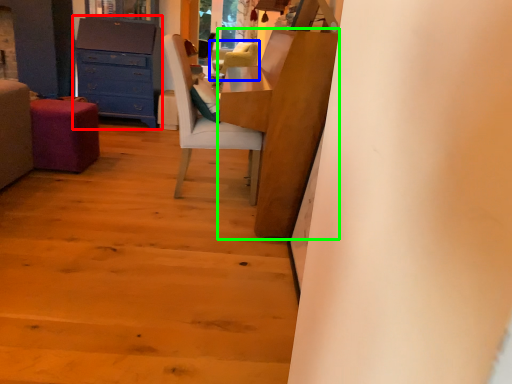
Question: Which object is positioned closest to chest of drawers (highlighted by a red box)? Select from chair (highlighted by a blue box) and table (highlighted by a green box).

Choices:
 (A) chair
 (B) table

Answer: (A)